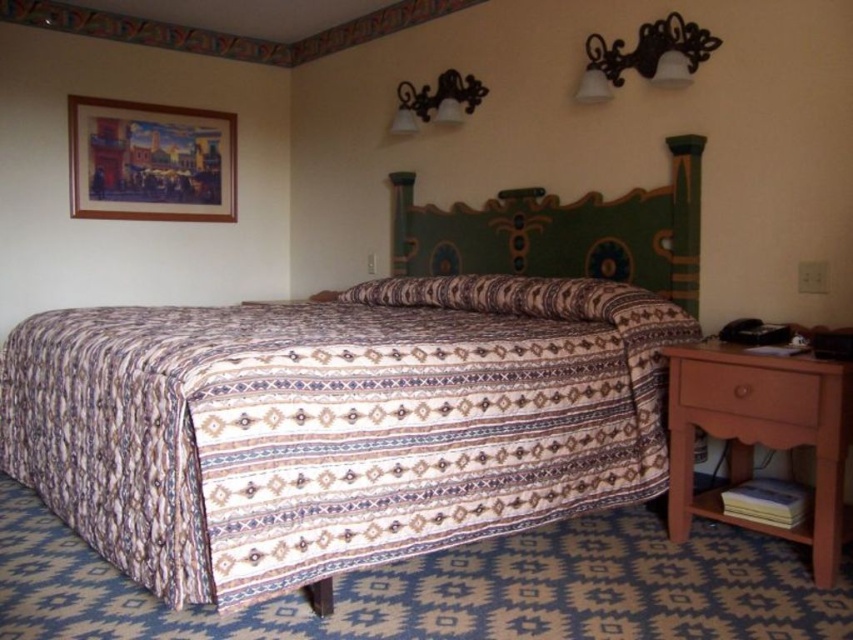
Who is shorter, brown wood drawer at lower right or black metal sconce at upper center?

With less height is brown wood drawer at lower right.

Can you confirm if brown wood drawer at lower right is positioned below black metal sconce at upper center?

Yes.

Does point (796, 394) come closer to viewer compared to point (664, 28)?

That is True.

This screenshot has height=640, width=853. What are the coordinates of `brown wood drawer at lower right` in the screenshot? It's located at (747, 390).

Who is taller, green painted wood headboard at upper center or black metal sconce at upper center?

green painted wood headboard at upper center

Is green painted wood headboard at upper center taller than black metal sconce at upper center?

Yes, green painted wood headboard at upper center is taller than black metal sconce at upper center.

Identify the location of green painted wood headboard at upper center. (563, 232).

In the scene shown: Between patterned fabric bed at center and green painted wood headboard at upper center, which one is positioned higher?

green painted wood headboard at upper center is higher up.

The width and height of the screenshot is (853, 640). What do you see at coordinates (363, 401) in the screenshot?
I see `patterned fabric bed at center` at bounding box center [363, 401].

Image resolution: width=853 pixels, height=640 pixels. Find the location of `patterned fabric bed at center`. patterned fabric bed at center is located at coordinates (363, 401).